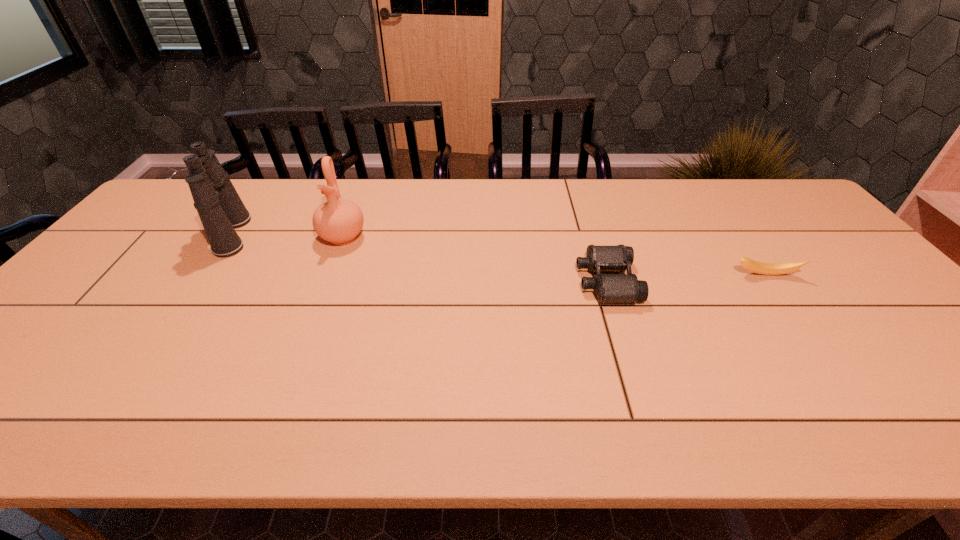
The image size is (960, 540). What are the coordinates of `vacant space that is in between the leftmost object and the second object from left to right` in the screenshot? It's located at (288, 235).

The width and height of the screenshot is (960, 540). I want to click on unoccupied position between the rightmost object and the second object from left to right, so click(x=554, y=256).

Where is `vacant point located between the left binoculars and the second object from left to right`? vacant point located between the left binoculars and the second object from left to right is located at coordinates (288, 235).

This screenshot has height=540, width=960. What are the coordinates of `unoccupied area between the pottery and the rightmost object` in the screenshot? It's located at (554, 256).

You are a GUI agent. You are given a task and a screenshot of the screen. Output one action in this format:
    pyautogui.click(x=<x>, y=<y>)
    Task: Click on the free point between the shorter binoculars and the rightmost object
    The width and height of the screenshot is (960, 540).
    Given the screenshot: What is the action you would take?
    pyautogui.click(x=685, y=278)

You are a GUI agent. You are given a task and a screenshot of the screen. Output one action in this format:
    pyautogui.click(x=<x>, y=<y>)
    Task: Click on the blank region between the left binoculars and the third object from right to left
    This screenshot has width=960, height=540.
    Given the screenshot: What is the action you would take?
    pyautogui.click(x=288, y=235)

You are a GUI agent. You are given a task and a screenshot of the screen. Output one action in this format:
    pyautogui.click(x=<x>, y=<y>)
    Task: Click on the empty location between the right binoculars and the leftmost object
    Image resolution: width=960 pixels, height=540 pixels.
    Given the screenshot: What is the action you would take?
    pyautogui.click(x=420, y=258)

I want to click on vacant space that's between the right binoculars and the pottery, so click(x=474, y=259).

What are the coordinates of `unoccupied position between the third object from left to right and the banana` in the screenshot? It's located at (685, 278).

Locate which object ranks second in proximity to the second object from right to left. Please provide its 2D coordinates. Your answer should be formatted as a tuple, i.e. [(x, y)], where the tuple contains the x and y coordinates of a point satisfying the conditions above.

[(339, 221)]